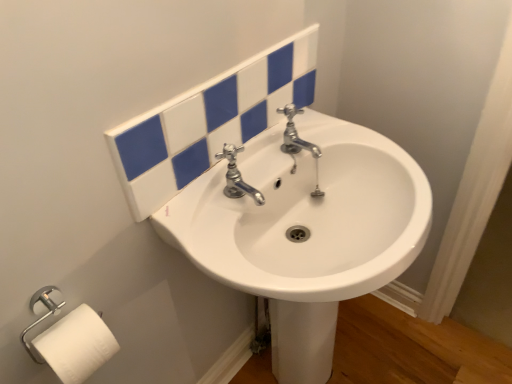
You are a GUI agent. You are given a task and a screenshot of the screen. Output one action in this format:
    pyautogui.click(x=<x>, y=<y>)
    Task: Click on the white matte toilet paper at lower left
    This screenshot has width=512, height=384.
    Given the screenshot: What is the action you would take?
    pyautogui.click(x=76, y=345)

Locate an element on the screen. The height and width of the screenshot is (384, 512). white glossy sink at center is located at coordinates (305, 228).

From a real-world perspective, relative to white glossy sink at center, is polished chrome faucet at center vertically above or below?

In terms of real-world spatial position, polished chrome faucet at center is above white glossy sink at center.

Considering the relative sizes of polished chrome faucet at center and white glossy sink at center in the image provided, is polished chrome faucet at center taller than white glossy sink at center?

No, polished chrome faucet at center is not taller than white glossy sink at center.

Is polished chrome faucet at center smaller than white glossy sink at center?

Indeed, polished chrome faucet at center has a smaller size compared to white glossy sink at center.

Is white glossy sink at center looking in the opposite direction of polished chrome faucet at center?

No, white glossy sink at center is not facing away from polished chrome faucet at center.

Is point (327, 278) closer or farther from the camera than point (224, 192)?

Point (327, 278).

Does white glossy sink at center have a greater width compared to polished chrome faucet at center?

Yes, white glossy sink at center is wider than polished chrome faucet at center.

Which of these two, white glossy sink at center or polished chrome faucet at center, stands taller?

With more height is white glossy sink at center.

Which is correct: white matte toilet paper at lower left is inside polished chrome faucet at center, or outside of it?

white matte toilet paper at lower left is not enclosed by polished chrome faucet at center.

Between white matte toilet paper at lower left and polished chrome faucet at center, which one is positioned behind?

polished chrome faucet at center.

Considering the sizes of objects white matte toilet paper at lower left and polished chrome faucet at center in the image provided, who is smaller, white matte toilet paper at lower left or polished chrome faucet at center?

polished chrome faucet at center is smaller.

From the picture: Can you confirm if white glossy sink at center is wider than white matte toilet paper at lower left?

Yes, white glossy sink at center is wider than white matte toilet paper at lower left.

Which object is closer to the camera, white glossy sink at center or white matte toilet paper at lower left?

white glossy sink at center.

Considering the positions of point (217, 199) and point (72, 380), is point (217, 199) closer or farther from the camera than point (72, 380)?

Point (217, 199) appears to be farther away from the viewer than point (72, 380).

From the image's perspective, which one is positioned higher, white glossy sink at center or white matte toilet paper at lower left?

white matte toilet paper at lower left.

Find the location of a particular element. tap behind the white matte toilet paper at lower left is located at coordinates (237, 177).

From a real-world perspective, is polished chrome faucet at center positioned over white matte toilet paper at lower left based on gravity?

Yes, from a real-world perspective, polished chrome faucet at center is on top of white matte toilet paper at lower left.

Considering the sizes of polished chrome faucet at center and white matte toilet paper at lower left in the image, is polished chrome faucet at center bigger or smaller than white matte toilet paper at lower left?

Considering their sizes, polished chrome faucet at center takes up less space than white matte toilet paper at lower left.

How different are the orientations of polished chrome faucet at center and white matte toilet paper at lower left in degrees?

The facing directions of polished chrome faucet at center and white matte toilet paper at lower left are 3.42 degrees apart.

From a real-world perspective, between white matte toilet paper at lower left and white glossy sink at center, who is vertically lower?

From a 3D spatial view, white glossy sink at center is below.

Looking at the image, does white matte toilet paper at lower left seem bigger or smaller compared to white glossy sink at center?

white matte toilet paper at lower left is smaller than white glossy sink at center.

Is white matte toilet paper at lower left behind white glossy sink at center?

That is True.

Find the location of `sink below the polished chrome faucet at center (from the image's perspective)`. sink below the polished chrome faucet at center (from the image's perspective) is located at coordinates (305, 228).

Image resolution: width=512 pixels, height=384 pixels. Find the location of `tap that appears above the white glossy sink at center (from the image's perspective)`. tap that appears above the white glossy sink at center (from the image's perspective) is located at coordinates (237, 177).

When comparing their distances from polished chrome faucet at center, does white glossy sink at center or white matte toilet paper at lower left seem further?

Among the two, white matte toilet paper at lower left is located further to polished chrome faucet at center.

Which object lies nearer to the anchor point white matte toilet paper at lower left, polished chrome faucet at center or white glossy sink at center?

Based on the image, polished chrome faucet at center appears to be nearer to white matte toilet paper at lower left.

Looking at the image, which one is located closer to white matte toilet paper at lower left, white glossy sink at center or polished chrome faucet at center?

polished chrome faucet at center.

When comparing their distances from white glossy sink at center, does polished chrome faucet at center or white matte toilet paper at lower left seem further?

Among the two, white matte toilet paper at lower left is located further to white glossy sink at center.

When comparing their distances from white glossy sink at center, does white matte toilet paper at lower left or polished chrome faucet at center seem closer?

The object closer to white glossy sink at center is polished chrome faucet at center.

From the image, which object appears to be farther from polished chrome faucet at center, white matte toilet paper at lower left or white glossy sink at center?

white matte toilet paper at lower left.

This screenshot has width=512, height=384. Find the location of `tap between white matte toilet paper at lower left and white glossy sink at center in the horizontal direction`. tap between white matte toilet paper at lower left and white glossy sink at center in the horizontal direction is located at coordinates (237, 177).